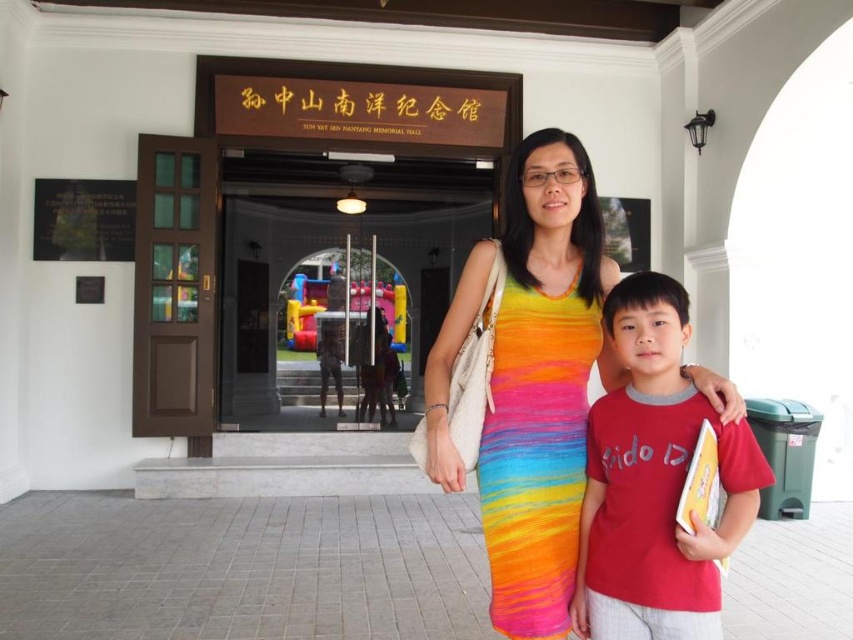
Does rainbow knit dress at center have a greater width compared to red cotton t-shirt at center?

Indeed, rainbow knit dress at center has a greater width compared to red cotton t-shirt at center.

Is point (497, 516) behind point (625, 419)?

That is True.

Who is more distant from viewer, (560, 216) or (646, 444)?

Point (560, 216)

This screenshot has height=640, width=853. In order to click on rainbow knit dress at center in this screenshot , I will do `click(543, 384)`.

Can you confirm if glass door at center is bigger than red cotton t-shirt at center?

Yes, glass door at center is bigger than red cotton t-shirt at center.

Which is in front, point (393, 252) or point (659, 524)?

Point (659, 524) is more forward.

Locate an element on the screen. glass door at center is located at coordinates (329, 301).

Is rainbow knit dress at center positioned behind glass door at center?

No, it is not.

Which is in front, point (566, 349) or point (439, 246)?

Point (566, 349)

What do you see at coordinates (543, 384) in the screenshot?
I see `rainbow knit dress at center` at bounding box center [543, 384].

Image resolution: width=853 pixels, height=640 pixels. I want to click on rainbow knit dress at center, so click(x=543, y=384).